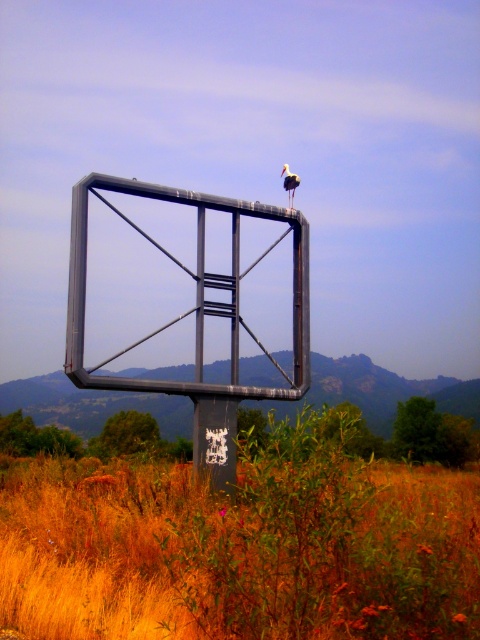
You are a photographer trying to capture a wide shot of the white matte bird at upper center and the brown dry grass at lower center. Which object will occupy more horizontal space in your photo?

The brown dry grass at lower center will occupy more horizontal space in the photo because its width surpasses that of the white matte bird at upper center.

You are a photographer aiming to capture the white matte bird at upper center and the brown dry grass at lower center in the same frame. Based on their positions, can you determine which object is closer to the camera?

The brown dry grass at lower center is positioned under the white matte bird at upper center, meaning the grass is closer to the camera than the bird.